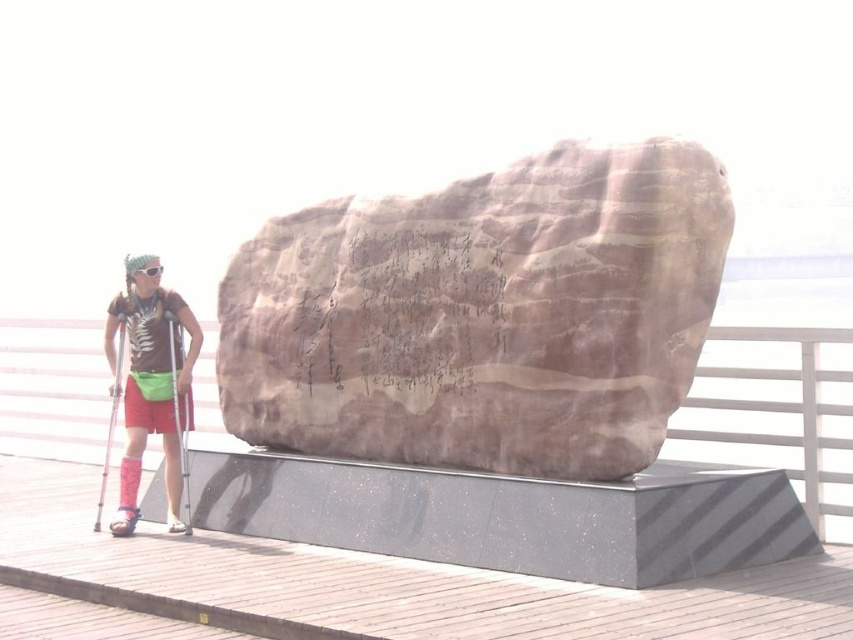
Can you confirm if glossy wood dock at lower center is thinner than metallic silver ski pole at left?

No.

Does glossy wood dock at lower center appear on the right side of metallic silver ski pole at left?

Correct, you'll find glossy wood dock at lower center to the right of metallic silver ski pole at left.

Is point (193, 593) behind point (99, 496)?

That is False.

The width and height of the screenshot is (853, 640). Identify the location of glossy wood dock at lower center. (387, 582).

Is matte brown shirt at center below metallic silver ski pole at left?

Incorrect, matte brown shirt at center is not positioned below metallic silver ski pole at left.

Does matte brown shirt at center lie in front of metallic silver ski pole at left?

No, matte brown shirt at center is further to the viewer.

Locate an element on the screen. This screenshot has height=640, width=853. matte brown shirt at center is located at coordinates (149, 381).

Is brown polished stone at center further to camera compared to matte brown shirt at center?

No, it is not.

Is point (276, 259) positioned after point (155, 304)?

Yes, it is behind point (155, 304).

I want to click on brown polished stone at center, so click(483, 314).